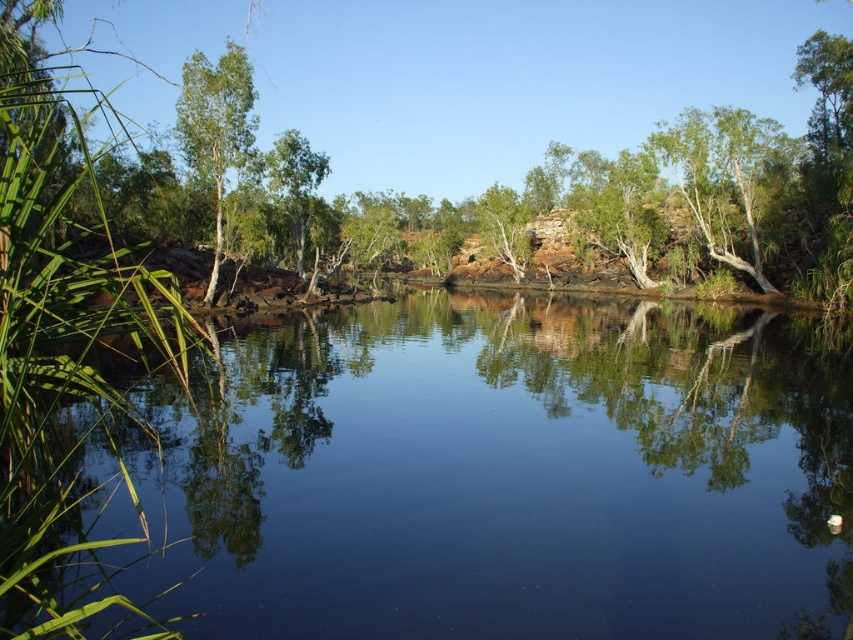
Looking at this image, you are a painter standing at the edge of the water. You want to paint the green smooth tree at left and the green leafy tree at center. Which tree should you move closer to if you want to paint more details of the trunk?

You should move closer to the green smooth tree at left because it might be wider than the green leafy tree at center, allowing you to capture more trunk details with finer precision.

You are standing at the edge of the water and want to place a small floating decoration. The decoration requires a space larger than the clear water at center. Can you determine if the green smooth tree at left has enough space for it?

The clear water at center occupies less space than the green smooth tree at left. Therefore, the green smooth tree at left has enough space for the decoration.

You are standing at the origin point in this natural setting. You see two points marked in the scene. Which point is closer to you, point (210, 160) or point (271, 193)?

Point (210, 160) is in front of point (271, 193), so it is closer to you.